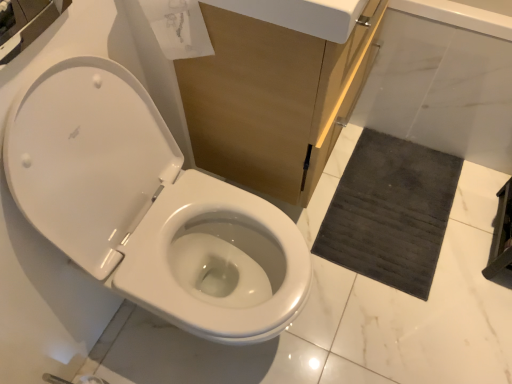
Locate an element on the screen. The width and height of the screenshot is (512, 384). vacant space situated on the left part of white marble bath at lower right is located at coordinates (369, 170).